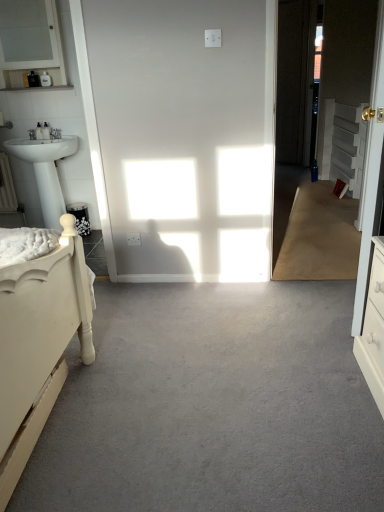
Locate an element on the screen. The image size is (384, 512). vacant space underneath matte white cabinet at upper left (from a real-world perspective) is located at coordinates (48, 136).